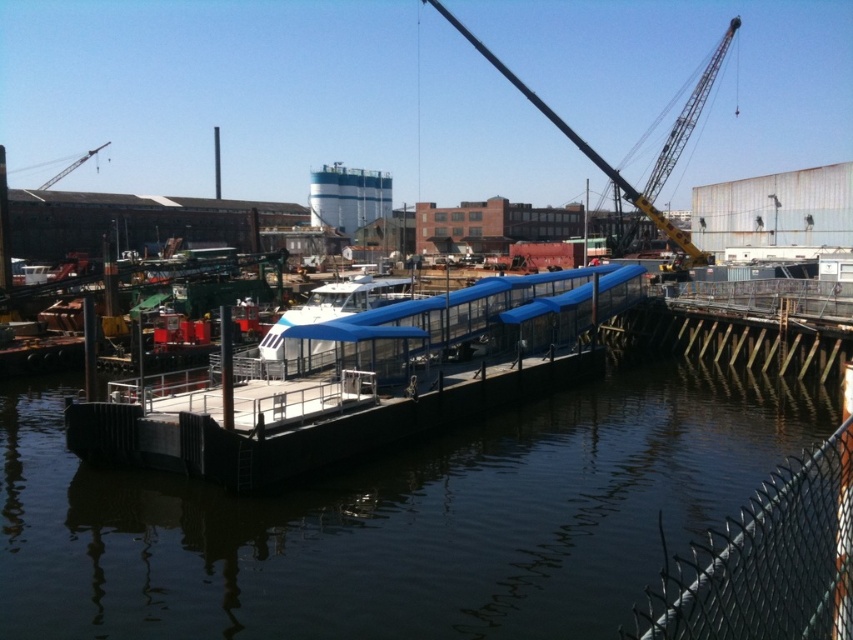
Who is more distant from viewer, (x=276, y=451) or (x=105, y=141)?

The point (x=105, y=141) is more distant.

Who is taller, blue tarpaulin boat at center or metallic yellow crane at upper left?

metallic yellow crane at upper left is taller.

Where is `blue tarpaulin boat at center`? The width and height of the screenshot is (853, 640). blue tarpaulin boat at center is located at coordinates (358, 381).

Between blue tarpaulin boat at center and black chain-link fence at lower right, which one has more height?

Standing taller between the two is blue tarpaulin boat at center.

Looking at this image, who is positioned more to the right, blue tarpaulin boat at center or black chain-link fence at lower right?

black chain-link fence at lower right

The height and width of the screenshot is (640, 853). Identify the location of blue tarpaulin boat at center. (358, 381).

Is transparent water at center positioned at the back of blue tarpaulin boat at center?

That is False.

The image size is (853, 640). What are the coordinates of `transparent water at center` in the screenshot? It's located at (399, 518).